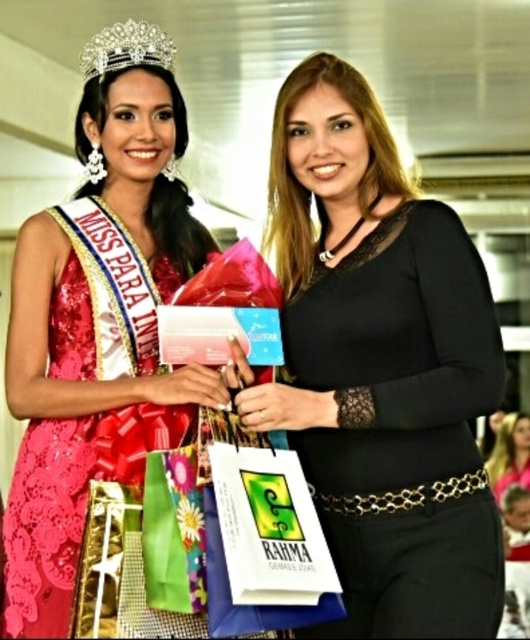
Question: Considering the real-world distances, which object is farthest from the smooth black dress at center?

Choices:
 (A) black lace top at center
 (B) diamond/crystal crown at upper center
 (C) shiny red dress at center

Answer: (B)

Question: Is shiny red dress at center positioned behind diamond/crystal crown at upper center?

Choices:
 (A) no
 (B) yes

Answer: (A)

Question: Does shiny red dress at center have a smaller size compared to smooth black dress at center?

Choices:
 (A) no
 (B) yes

Answer: (A)

Question: Estimate the real-world distances between objects in this image. Which object is farther from the smooth black dress at center?

Choices:
 (A) black lace top at center
 (B) diamond/crystal crown at upper center

Answer: (B)

Question: Which of the following is the closest to the observer?

Choices:
 (A) black lace top at center
 (B) smooth black dress at center
 (C) diamond/crystal crown at upper center
 (D) shiny red dress at center

Answer: (D)

Question: Does black lace top at center come behind smooth black dress at center?

Choices:
 (A) yes
 (B) no

Answer: (B)